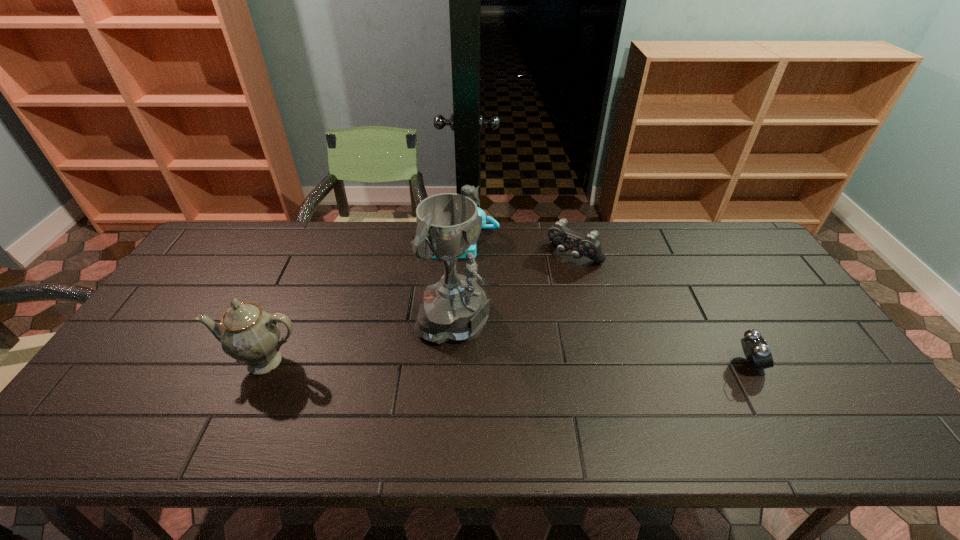
The image size is (960, 540). I want to click on free spot that satisfies the following two spatial constraints: 1. on the front side of the rightmost object; 2. on the face of the third tallest object, so click(x=453, y=364).